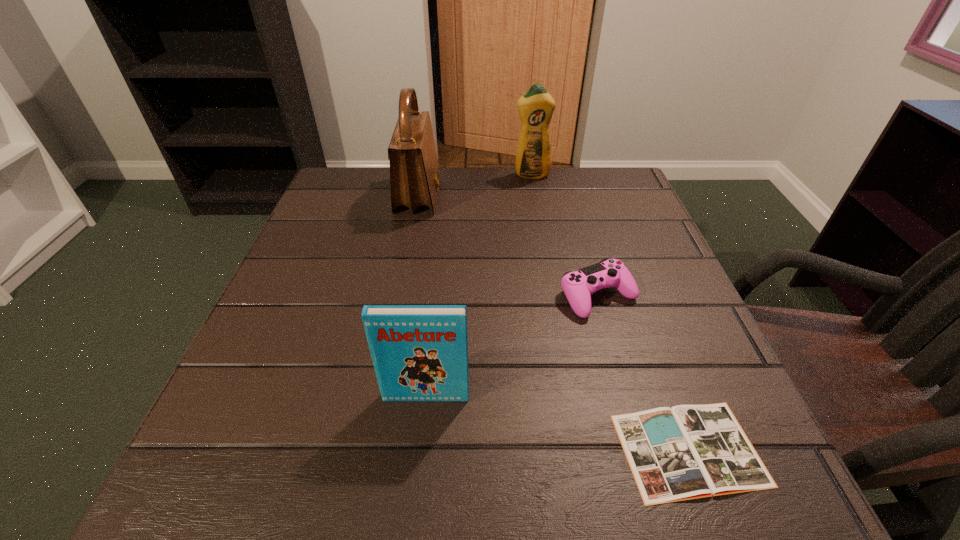
Image resolution: width=960 pixels, height=540 pixels. In order to click on shoulder bag in this screenshot , I will do `click(414, 170)`.

Where is `detergent`? detergent is located at coordinates (533, 157).

Identify the location of the left book. Image resolution: width=960 pixels, height=540 pixels. (420, 352).

The width and height of the screenshot is (960, 540). In order to click on the third tallest object in this screenshot , I will do `click(420, 352)`.

Identify the location of the third farthest object. (578, 286).

Image resolution: width=960 pixels, height=540 pixels. Identify the location of the fourth tallest object. (578, 286).

Locate an element on the screen. This screenshot has width=960, height=540. the right book is located at coordinates (685, 452).

Locate an element on the screen. the shorter book is located at coordinates (685, 452).

Locate an element on the screen. Image resolution: width=960 pixels, height=540 pixels. free space located 0.090m on the front flap of the shoulder bag is located at coordinates (475, 195).

Locate an element on the screen. This screenshot has height=540, width=960. free spot located 0.370m on the label of the detergent is located at coordinates [548, 273].